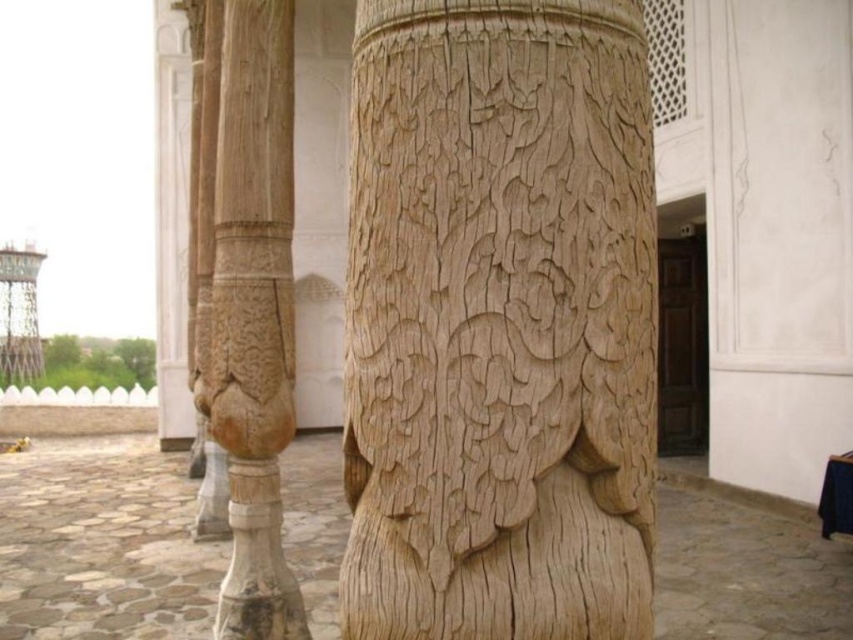
Does natural wood column at center appear on the left side of wooden carved column at center?

In fact, natural wood column at center is to the right of wooden carved column at center.

Does point (601, 228) come in front of point (262, 60)?

Yes, point (601, 228) is in front of point (262, 60).

Identify the location of natural wood column at center. (498, 323).